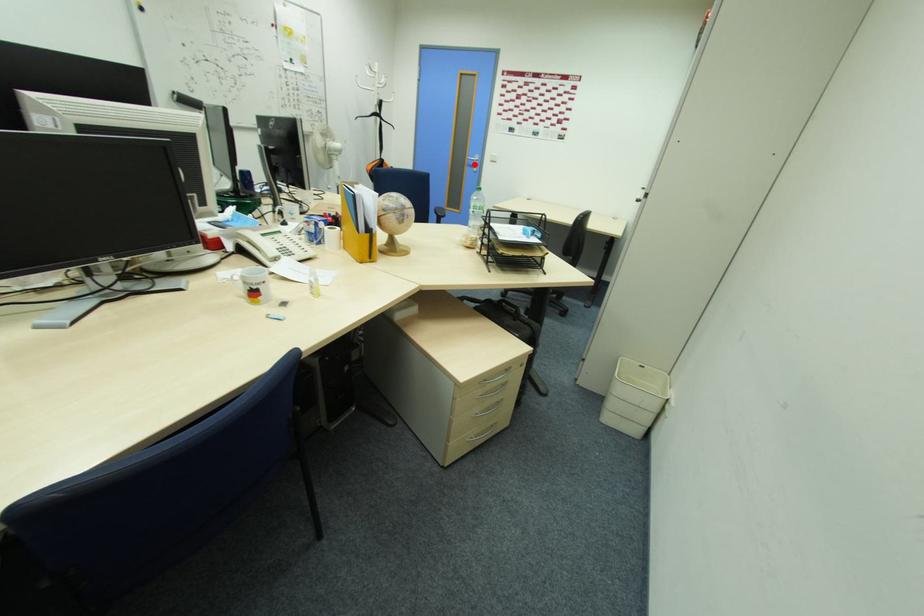
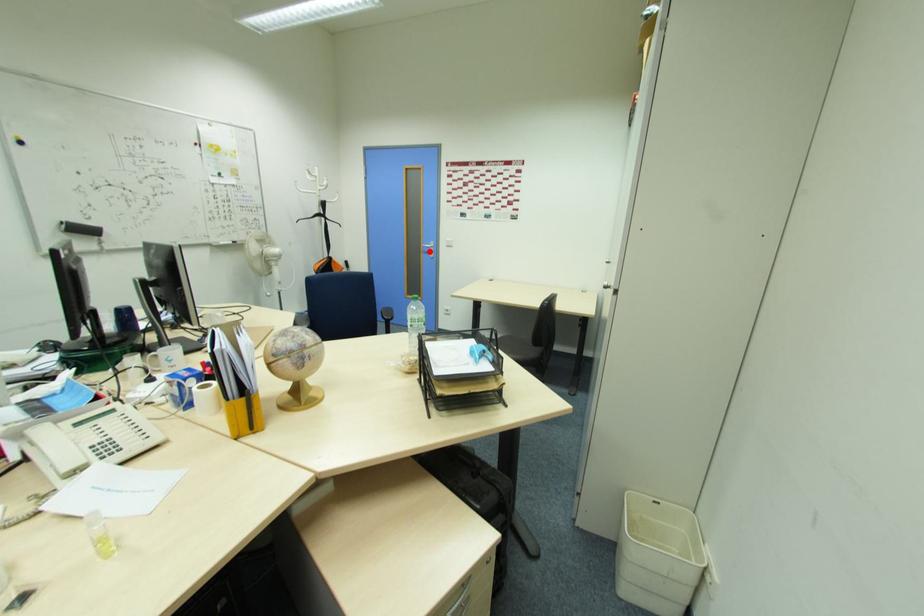
I am providing you with two images of the same scene from different viewpoints. A red point is marked on the first image and another point is marked on the second image. Is the red point in image1 aligned with the point shown in image2?

Yes